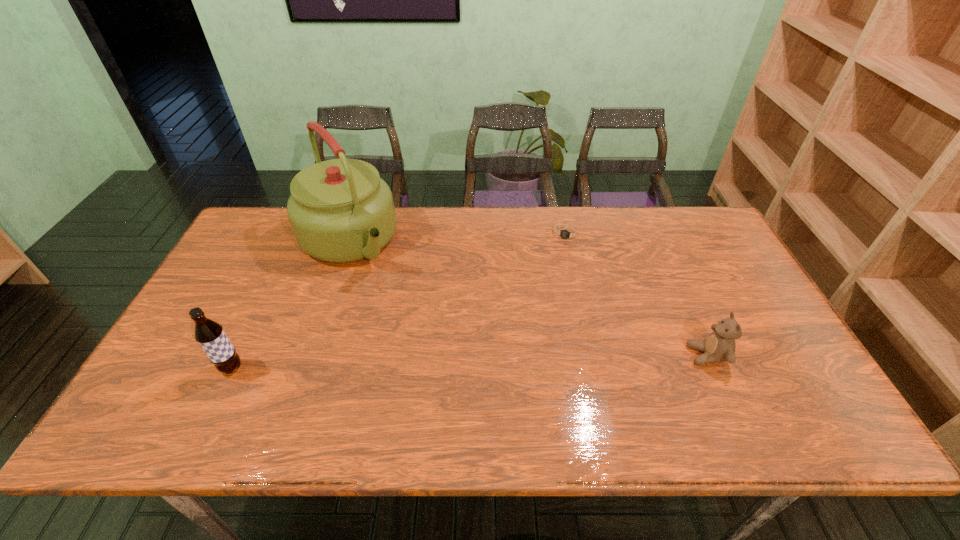
Find the location of a particular element. This screenshot has width=960, height=540. root beer is located at coordinates (210, 335).

You are a GUI agent. You are given a task and a screenshot of the screen. Output one action in this format:
    pyautogui.click(x=<x>, y=<y>)
    Task: Click on the third tallest object
    
    Given the screenshot: What is the action you would take?
    pyautogui.click(x=719, y=346)

You are a GUI agent. You are given a task and a screenshot of the screen. Output one action in this format:
    pyautogui.click(x=<x>, y=<y>)
    Task: Click on the teddy bear
    
    Given the screenshot: What is the action you would take?
    pyautogui.click(x=719, y=346)

Where is `kettle`? The image size is (960, 540). kettle is located at coordinates (340, 210).

This screenshot has height=540, width=960. Identify the location of the second object from right to left. (566, 234).

Where is `the shortest object`? The width and height of the screenshot is (960, 540). the shortest object is located at coordinates (566, 234).

At what (x,y) coordinates should I click in order to perform the action: click on vacant area located 0.360m on the back of the third shortest object. Please return your answer as a coordinate pair (x, y). Image resolution: width=960 pixels, height=540 pixels. Looking at the image, I should click on pos(282,261).

Find the location of a particular element. vacant space located on the front-facing side of the teddy bear is located at coordinates (613, 355).

You are a GUI agent. You are given a task and a screenshot of the screen. Output one action in this format:
    pyautogui.click(x=<x>, y=<y>)
    Task: Click on the free location located 0.110m on the front-facing side of the teddy bear
    
    Given the screenshot: What is the action you would take?
    pyautogui.click(x=645, y=355)

At what (x,y) coordinates should I click in order to perform the action: click on vacant space located 0.110m on the front-facing side of the teddy bear. Please return your answer as a coordinate pair (x, y). Looking at the image, I should click on (645, 355).